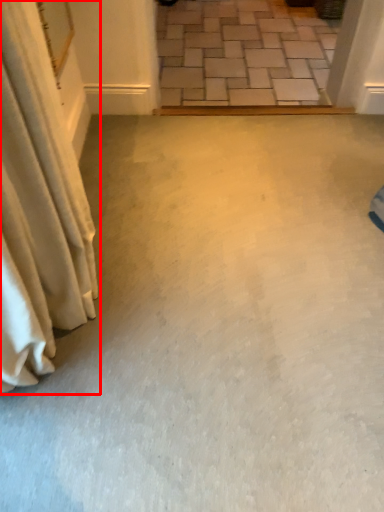
Question: From the image's perspective, where is curtain (annotated by the red box) located in relation to concrete in the image?

Choices:
 (A) below
 (B) above

Answer: (A)